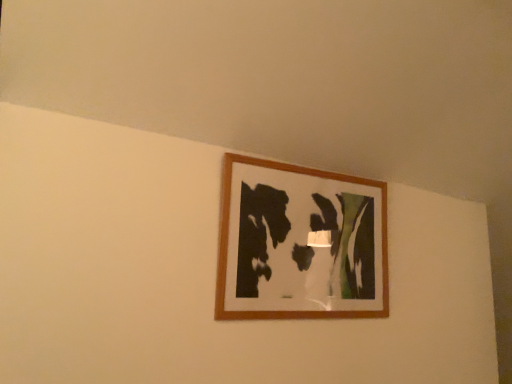
What do you see at coordinates (300, 243) in the screenshot? This screenshot has width=512, height=384. I see `wooden picture frame at upper center` at bounding box center [300, 243].

I want to click on wooden picture frame at upper center, so click(x=300, y=243).

Measure the distance between wooden picture frame at upper center and camera.

They are 1.32 meters apart.

Measure the distance between point (257, 225) and camera.

Point (257, 225) and camera are 4.70 feet apart from each other.

The image size is (512, 384). Identify the location of wooden picture frame at upper center. (300, 243).